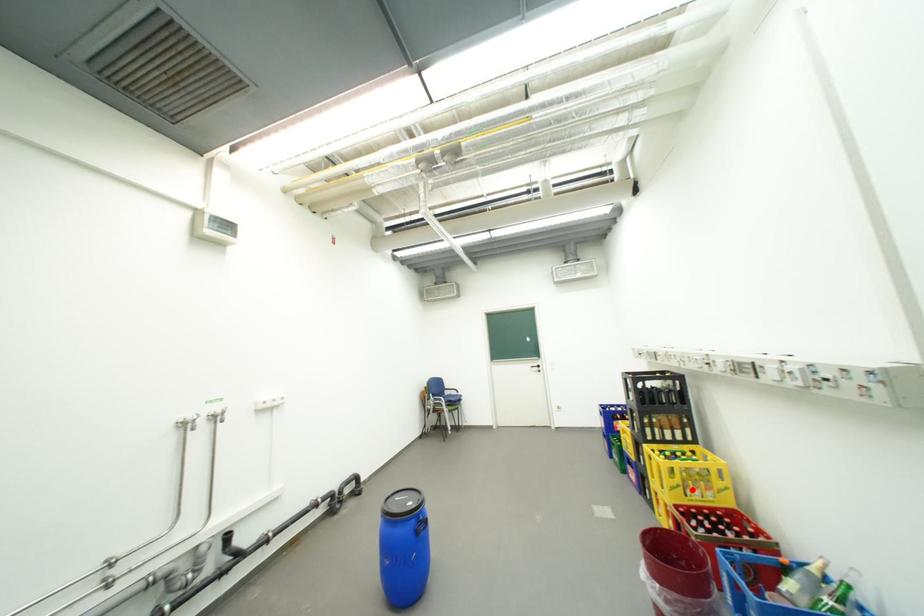
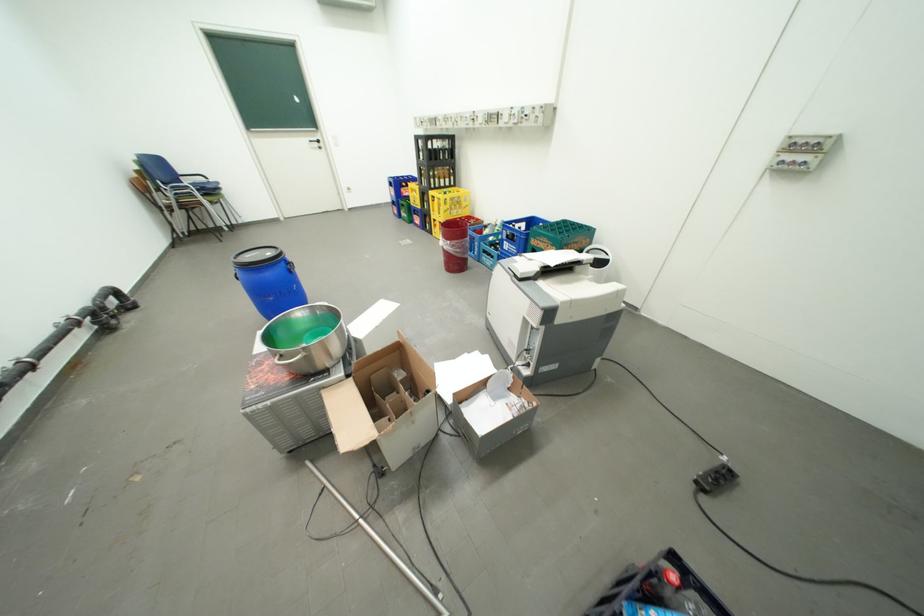
Question: I am providing you with two images of the same scene from different viewpoints. A red point is marked on the first image. Is the red point's position out of view in image 2?

Choices:
 (A) Yes
 (B) No

Answer: (B)